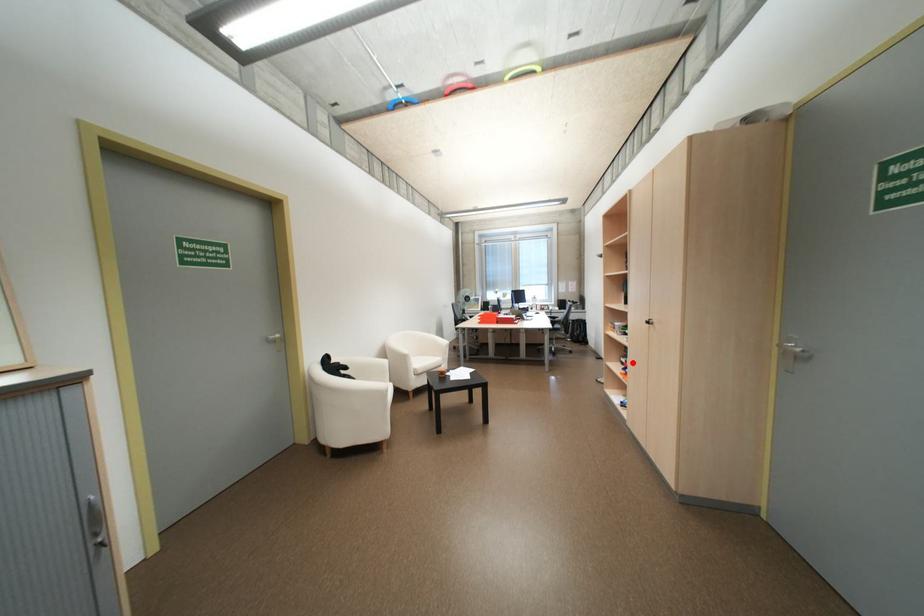
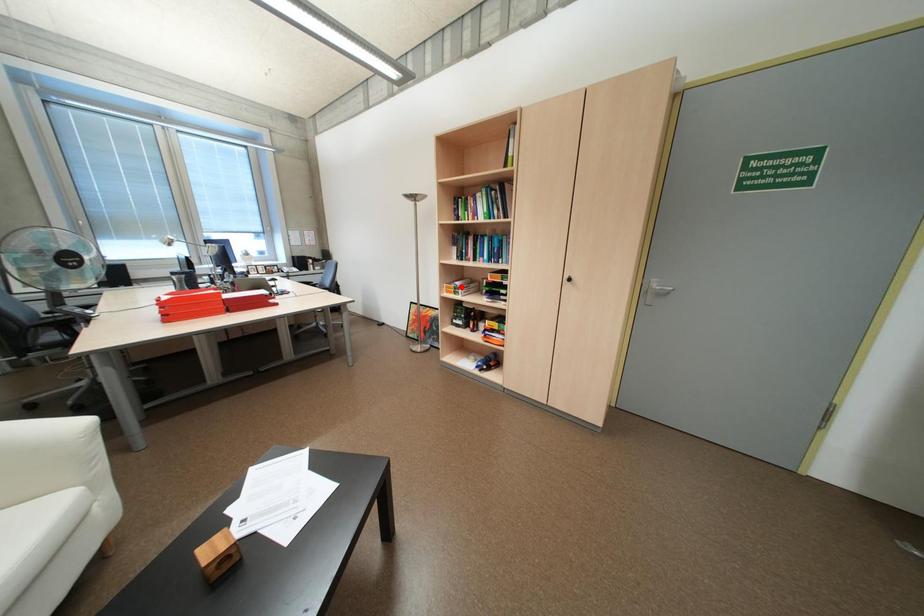
I am providing you with two images of the same scene from different viewpoints. A red point is marked on the first image and another point is marked on the second image. Is the marked point in image1 the same physical position as the marked point in image2?

No